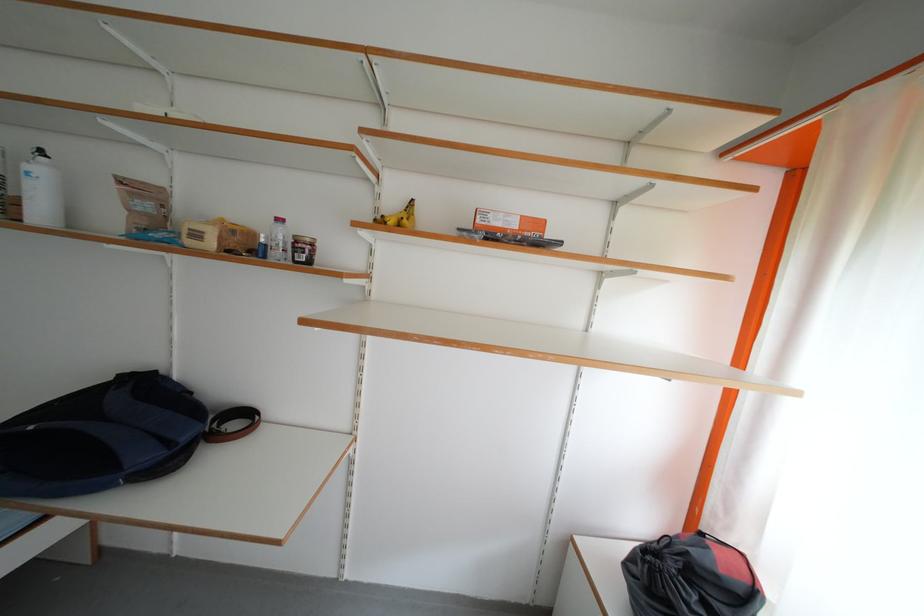
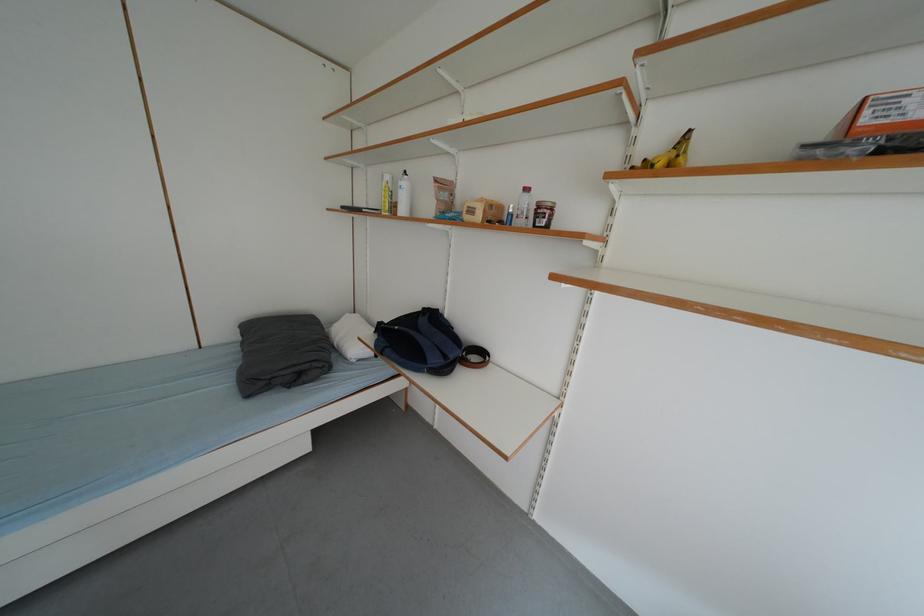
Find the pixel in the second image that matches point 387,221 in the first image.

(648, 167)